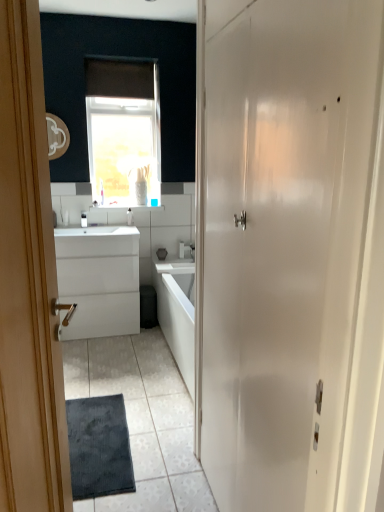
Locate an element on the screen. free spot above white glossy sink at center (from a real-world perspective) is located at coordinates (91, 229).